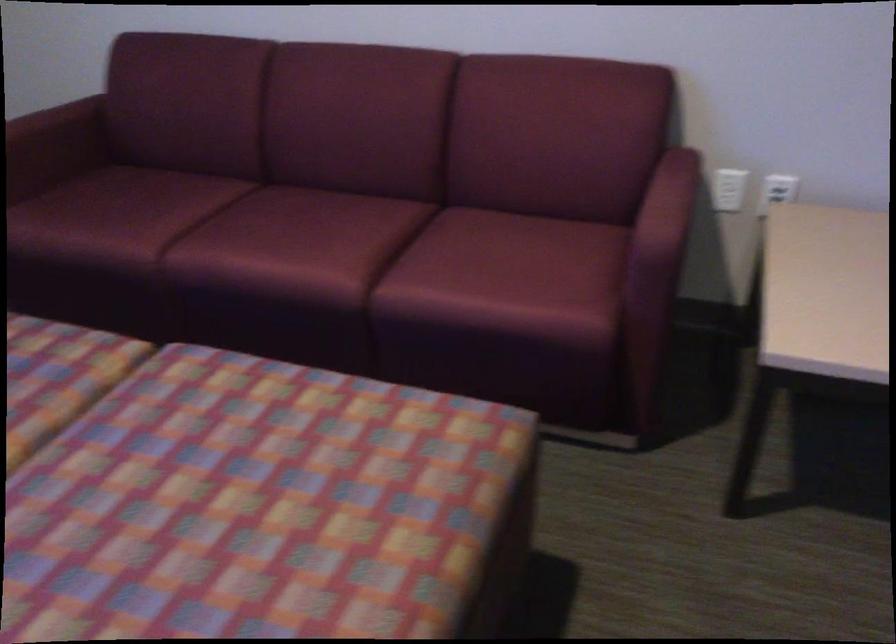
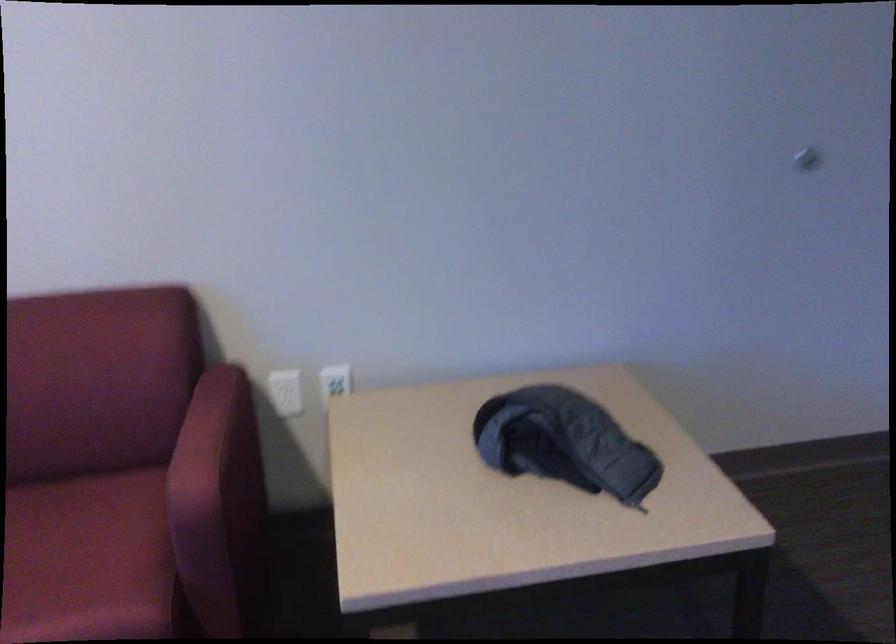
Locate, in the second image, the point that corresponds to (722,187) in the first image.

(286, 392)